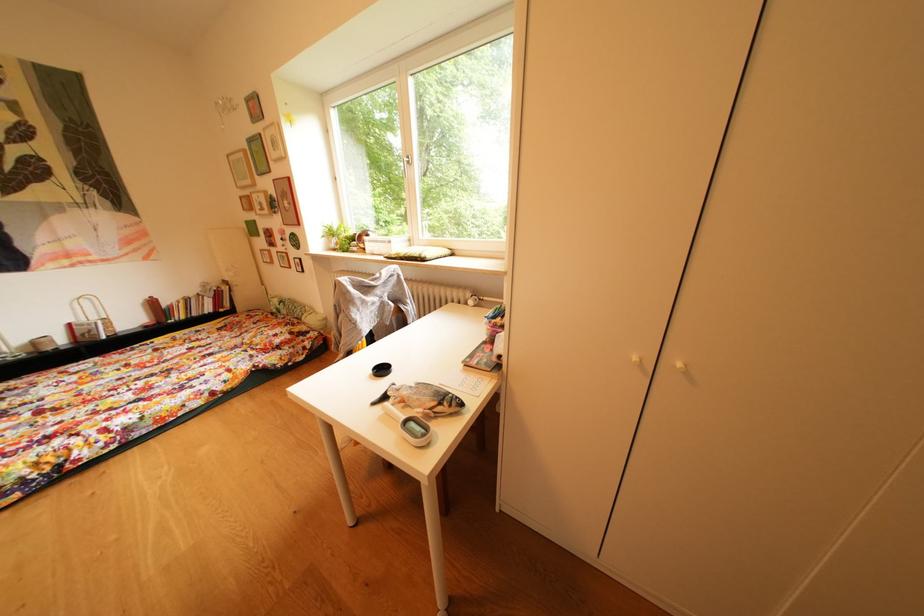
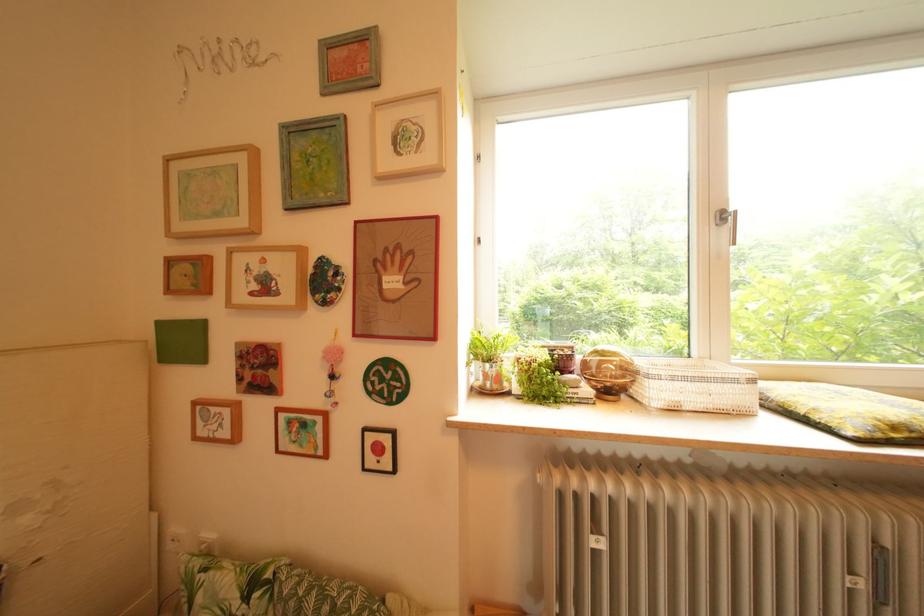
In a continuous first-person perspective shot, in which direction is the camera moving?

The cameraman moved toward left, forward.